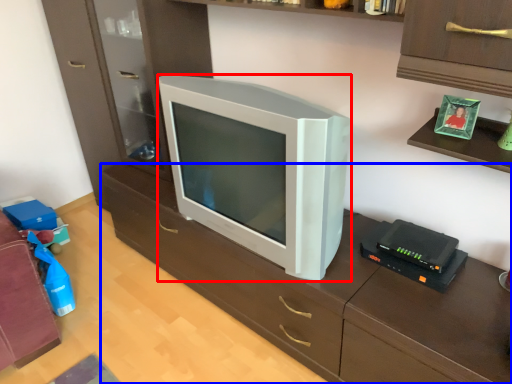
Question: Which object is further to the camera taking this photo, television (highlighted by a red box) or computer desk (highlighted by a blue box)?

Choices:
 (A) television
 (B) computer desk

Answer: (A)